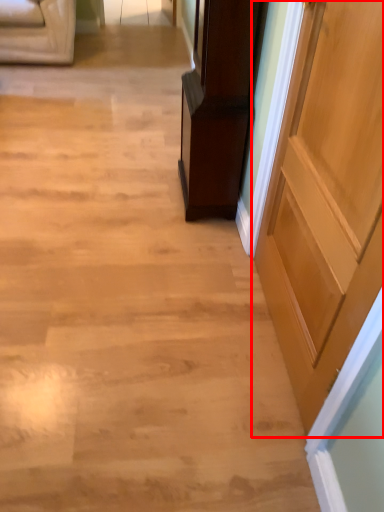
Question: From the image's perspective, what is the correct spatial relationship of door (annotated by the red box) in relation to furniture?

Choices:
 (A) below
 (B) above

Answer: (A)